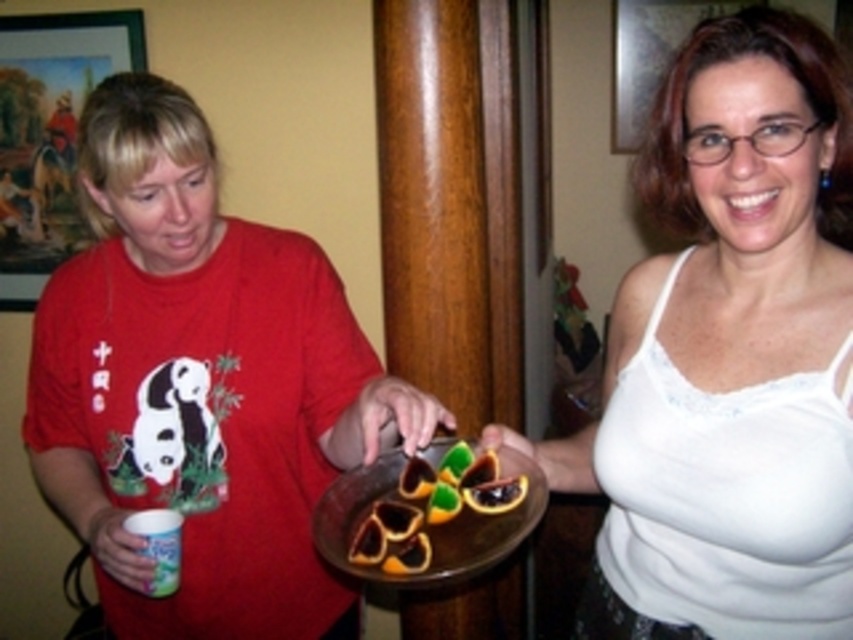
Question: Which object is positioned farthest from the semi-glossy orange slices at center?

Choices:
 (A) matte red shirt at left
 (B) white fabric tank top at center

Answer: (A)

Question: Considering the relative positions of matte red shirt at left and semi-glossy orange slices at center in the image provided, where is matte red shirt at left located with respect to semi-glossy orange slices at center?

Choices:
 (A) below
 (B) above

Answer: (B)

Question: Which point is farther to the camera?

Choices:
 (A) (759, 234)
 (B) (80, 401)
 (C) (477, 515)

Answer: (B)

Question: Among these objects, which one is farthest from the camera?

Choices:
 (A) matte red shirt at left
 (B) semi-glossy orange slices at center

Answer: (A)

Question: Is matte red shirt at left smaller than white fabric tank top at center?

Choices:
 (A) yes
 (B) no

Answer: (B)

Question: Can you confirm if matte red shirt at left is smaller than white fabric tank top at center?

Choices:
 (A) no
 (B) yes

Answer: (A)